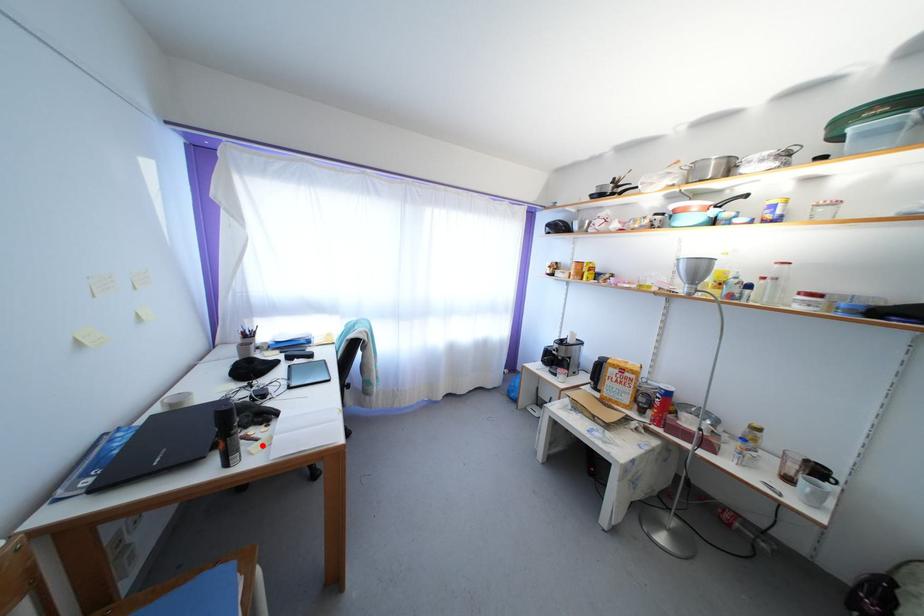
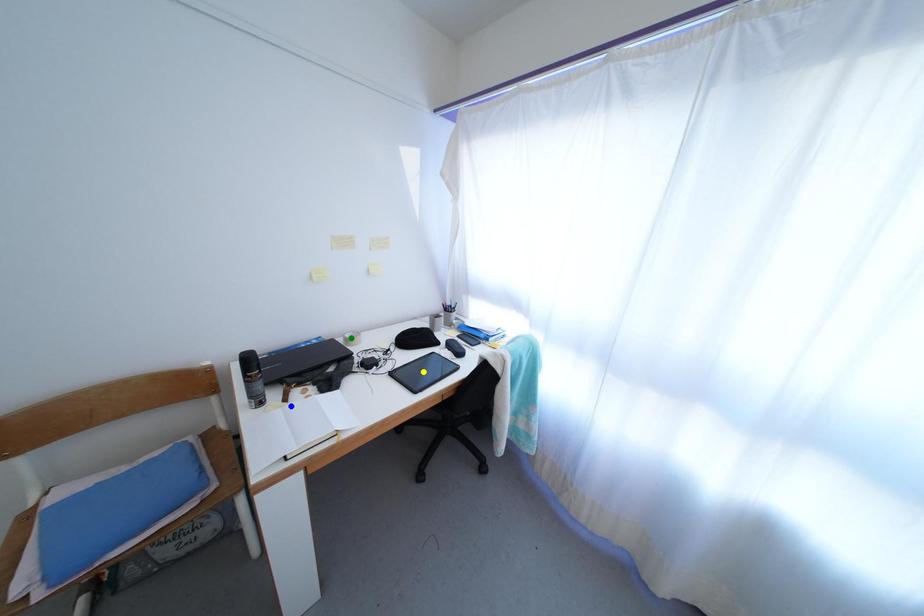
Question: I am providing you with two images of the same scene from different viewpoints. A red point is marked on the first image. You are given multiple points on the second image. Which point in image 2 is actually the same real-world point as the red point in image 1?

Choices:
 (A) green point
 (B) blue point
 (C) yellow point

Answer: (B)